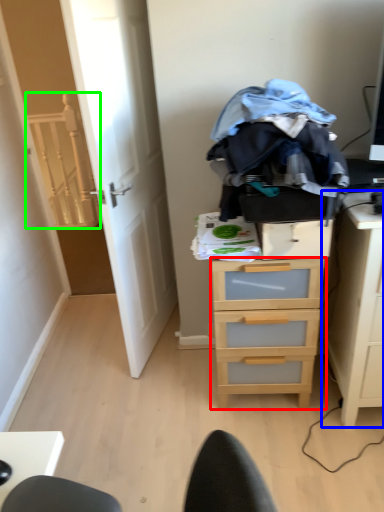
Question: Considering the real-world distances, which object is farthest from chest of drawers (highlighted by a red box)? nightstand (highlighted by a blue box) or stairwell (highlighted by a green box)?

Choices:
 (A) nightstand
 (B) stairwell

Answer: (B)